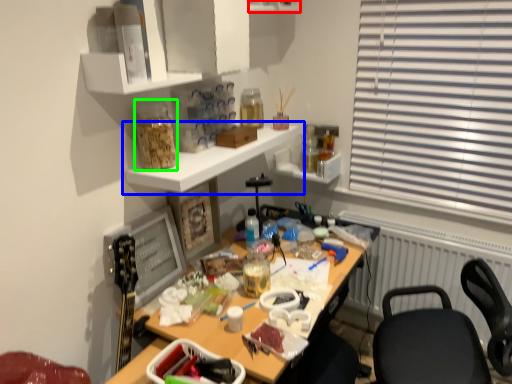
Question: Which object is positioned farthest from shelf (highlighted by a red box)? Select from shelf (highlighted by a blue box) and bottle (highlighted by a green box).

Choices:
 (A) shelf
 (B) bottle

Answer: (B)